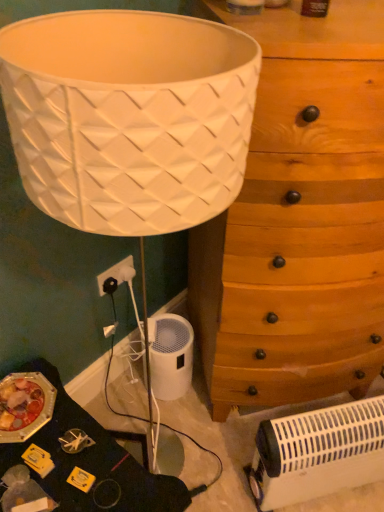
Question: Considering the positions of white plastic heater at lower right and white plastic electric outlet at lower left in the image, is white plastic heater at lower right wider or thinner than white plastic electric outlet at lower left?

Choices:
 (A) thin
 (B) wide

Answer: (B)

Question: Considering their positions, is white plastic heater at lower right located in front of or behind white plastic electric outlet at lower left?

Choices:
 (A) front
 (B) behind

Answer: (A)

Question: Estimate the real-world distances between objects in this image. Which object is closer to the white plastic electric outlet at lower left?

Choices:
 (A) white plastic heater at lower right
 (B) wooden chest of drawers at center-right

Answer: (B)

Question: Estimate the real-world distances between objects in this image. Which object is closer to the white plastic electric outlet at lower left?

Choices:
 (A) wooden chest of drawers at center-right
 (B) white plastic heater at lower right

Answer: (A)